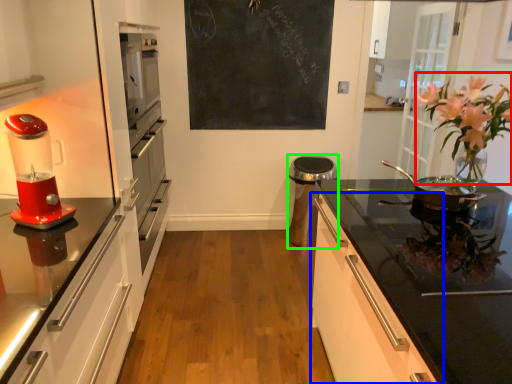
Question: Considering the real-world distances, which object is farthest from floral arrangement (highlighted by a red box)? cabinetry (highlighted by a blue box) or appliance (highlighted by a green box)?

Choices:
 (A) cabinetry
 (B) appliance

Answer: (B)